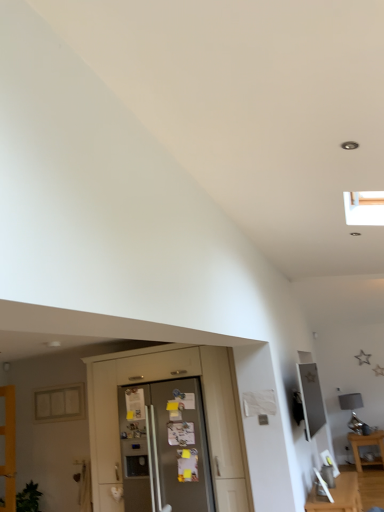
Question: Would you say wooden door at left is to the left or to the right of metallic silver frame at upper right in the picture?

Choices:
 (A) left
 (B) right

Answer: (A)

Question: Is wooden door at left situated inside metallic silver frame at upper right or outside?

Choices:
 (A) outside
 (B) inside

Answer: (A)

Question: Which object is positioned closest to the wooden table at lower right?

Choices:
 (A) satin silver refrigerator at center
 (B) wooden door at left
 (C) matte glass window at left
 (D) metallic silver frame at upper right
 (E) satin silver refrigerator at center

Answer: (D)

Question: Which object is the closest to the wooden door at left?

Choices:
 (A) matte glass window at left
 (B) wooden table at lower right
 (C) metallic silver frame at upper right
 (D) satin silver refrigerator at center
 (E) satin silver refrigerator at center

Answer: (A)